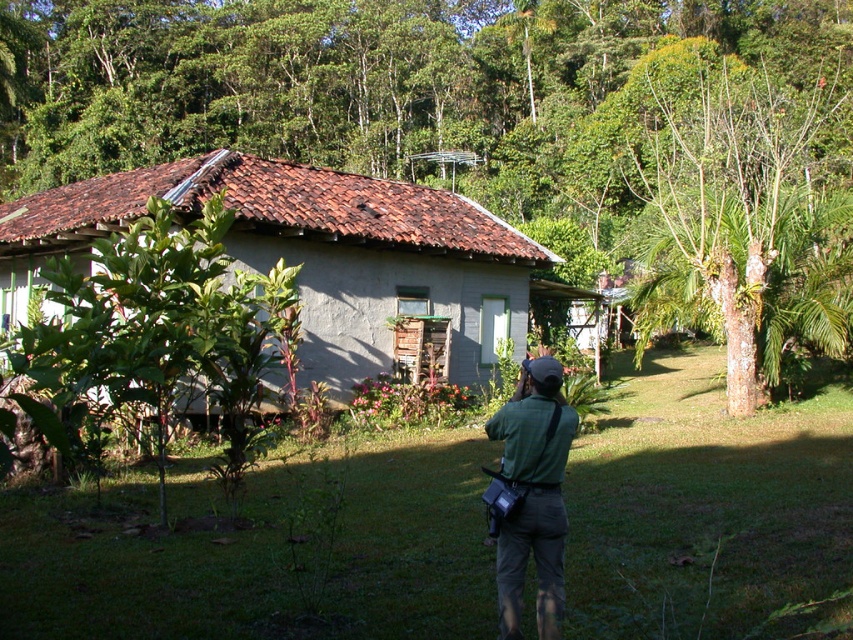
You are standing in the front yard of the house and see the brown wood tree at center and the smooth brown trunk at upper right. Which tree is closer to the left side of the property?

The brown wood tree at center is positioned on the left side of smooth brown trunk at upper right, so it is closer to the left side of the property.

You are standing at the point marked as point (167, 332) in the rural scene. What type of vegetation are you currently standing on?

You are standing on a green leafy plant at center.

You are standing in the middle of the lawn and see the gray stucco hut at center and the green leafy plant at center. Which object is positioned to the left?

The gray stucco hut at center is to the left of the green leafy plant at center, so the gray stucco hut at center is positioned to the left.